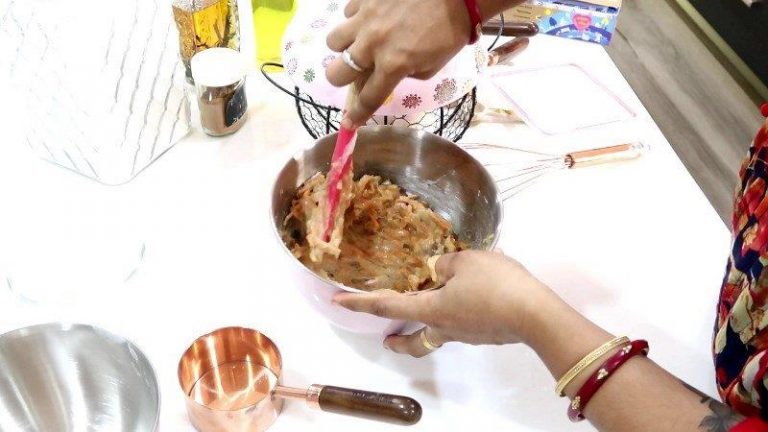
Where is `red spatula`? The image size is (768, 432). red spatula is located at coordinates pyautogui.click(x=339, y=130).